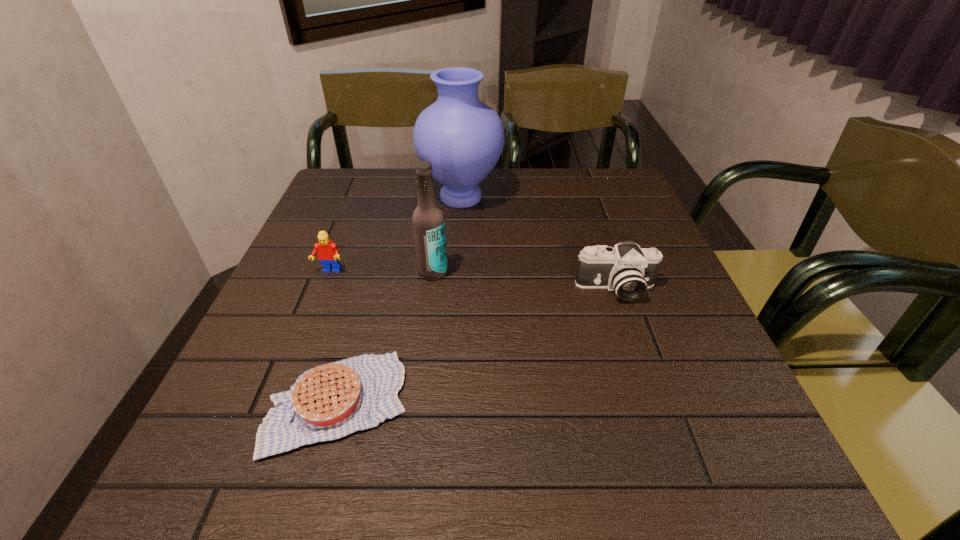
I want to click on vase, so click(x=463, y=138).

You are a GUI agent. You are given a task and a screenshot of the screen. Output one action in this format:
    pyautogui.click(x=<x>, y=<y>)
    Task: Click on the farthest object
    Image resolution: width=960 pixels, height=540 pixels.
    Given the screenshot: What is the action you would take?
    pyautogui.click(x=463, y=138)

Identify the location of the second tallest object. (428, 219).

This screenshot has height=540, width=960. Identify the location of the rightmost object. pyautogui.click(x=628, y=270).

Where is `Lego`? Image resolution: width=960 pixels, height=540 pixels. Lego is located at coordinates (328, 253).

Locate an element on the screen. pie is located at coordinates (330, 401).

The width and height of the screenshot is (960, 540). In order to click on the shortest object in this screenshot , I will do `click(330, 401)`.

The image size is (960, 540). What are the coordinates of `free space located 0.110m on the left of the farthest object` in the screenshot? It's located at (379, 197).

The image size is (960, 540). I want to click on vacant space located on the label of the beer bottle, so click(x=419, y=392).

The width and height of the screenshot is (960, 540). What are the coordinates of `free region located 0.150m on the left of the camera` in the screenshot? It's located at (504, 289).